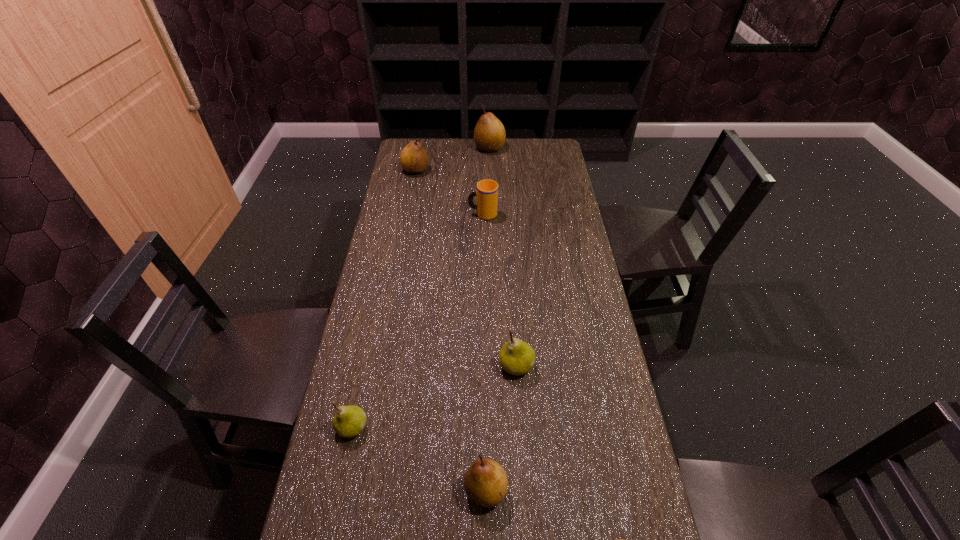
The image size is (960, 540). Identify the location of object present at the far left corner. (414, 159).

Locate an element on the screen. free space at the left edge is located at coordinates (372, 458).

In the image, there is a desktop. Where is `vacant region at the right edge`? vacant region at the right edge is located at coordinates (548, 258).

In the image, there is a desktop. Where is `blank space at the far right corner`? The width and height of the screenshot is (960, 540). blank space at the far right corner is located at coordinates (529, 145).

At what (x,y) coordinates should I click in order to perform the action: click on vacant region between the smaller green pear and the farthest object. Please return your answer as a coordinate pair (x, y). Looking at the image, I should click on (420, 287).

Identify the location of free space between the second nearest pear and the tallest pear. This screenshot has width=960, height=540. (488, 319).

At what (x,y) coordinates should I click in order to perform the action: click on free space between the fifth nearest pear and the beige cup. Please return your answer as a coordinate pair (x, y). Looking at the image, I should click on (449, 192).

Where is `unoccupied position between the leftmost brown pear and the smaller green pear`? This screenshot has width=960, height=540. unoccupied position between the leftmost brown pear and the smaller green pear is located at coordinates (384, 299).

Find the location of a particular element. empty space between the third smallest brown pear and the bigger green pear is located at coordinates (466, 268).

Select which object appears as the fourth closest to the shortest pear. Please provide its 2D coordinates. Your answer should be formatted as a tuple, i.e. [(x, y)], where the tuple contains the x and y coordinates of a point satisfying the conditions above.

[(487, 190)]